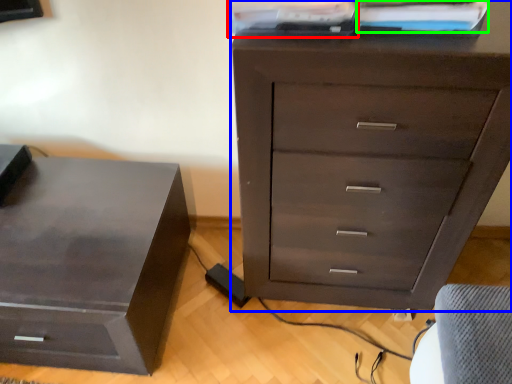
Question: Which is nearer to the book (highlighted by a red box)? chest of drawers (highlighted by a blue box) or book (highlighted by a green box).

Choices:
 (A) chest of drawers
 (B) book

Answer: (B)